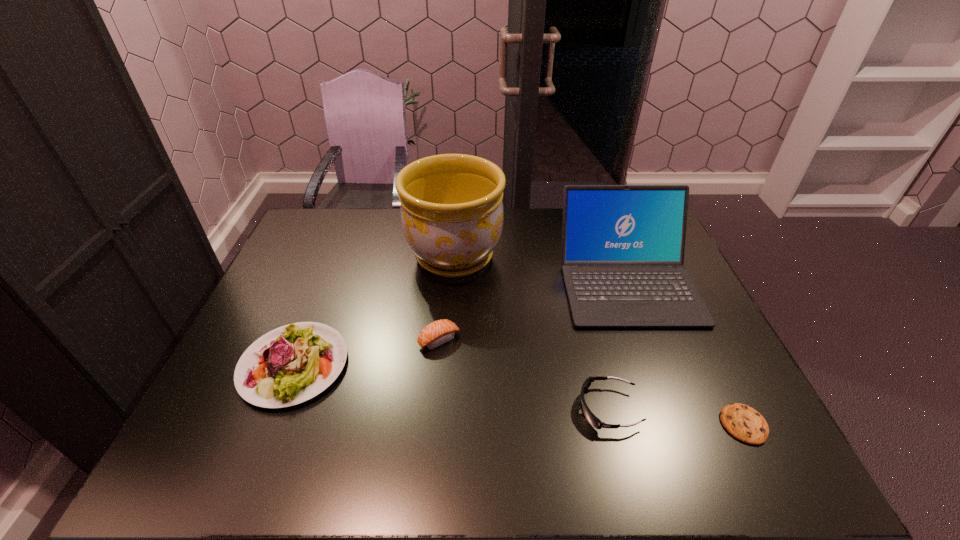
Locate an element on the screen. vacant space that's between the cookie and the flowerpot is located at coordinates point(599,340).

This screenshot has height=540, width=960. What are the coordinates of `vacant area that lies between the leftmost object and the laptop computer` in the screenshot? It's located at (461, 323).

Find the location of a particular element. vacant space in between the laptop computer and the leftmost object is located at coordinates (461, 323).

In order to click on vacant area that lies between the laptop computer and the third tallest object in this screenshot , I will do (461, 323).

Where is `free spot between the leftmost object and the second tallest object`? free spot between the leftmost object and the second tallest object is located at coordinates (461, 323).

Locate an element on the screen. free spot between the sushi and the laptop computer is located at coordinates (533, 311).

Where is `vacant space that is in between the leftmost object and the goggles`? vacant space that is in between the leftmost object and the goggles is located at coordinates (451, 387).

Identify the location of unoccupied area between the flowerpot and the sushi. The height and width of the screenshot is (540, 960). (446, 298).

Image resolution: width=960 pixels, height=540 pixels. Find the location of `object that is the fifth nearest to the tallest object`. object that is the fifth nearest to the tallest object is located at coordinates (744, 423).

Find the location of `object that stands as the fifth closest to the salad plate`. object that stands as the fifth closest to the salad plate is located at coordinates (744, 423).